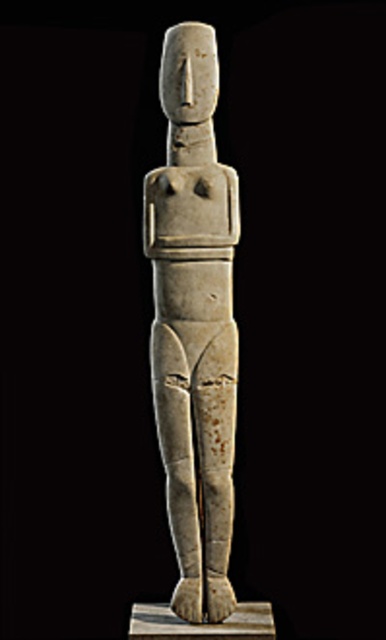
Question: Does white stone figure at center appear on the right side of white stone pillar at center?

Choices:
 (A) no
 (B) yes

Answer: (A)

Question: Which object appears closest to the camera in this image?

Choices:
 (A) white stone pillar at center
 (B) white stone figure at center

Answer: (B)

Question: Which point is farther to the camera?

Choices:
 (A) white stone figure at center
 (B) white stone pillar at center

Answer: (B)

Question: Is white stone figure at center thinner than white stone pillar at center?

Choices:
 (A) no
 (B) yes

Answer: (B)

Question: Observing the image, what is the correct spatial positioning of white stone figure at center in reference to white stone pillar at center?

Choices:
 (A) below
 (B) above

Answer: (B)